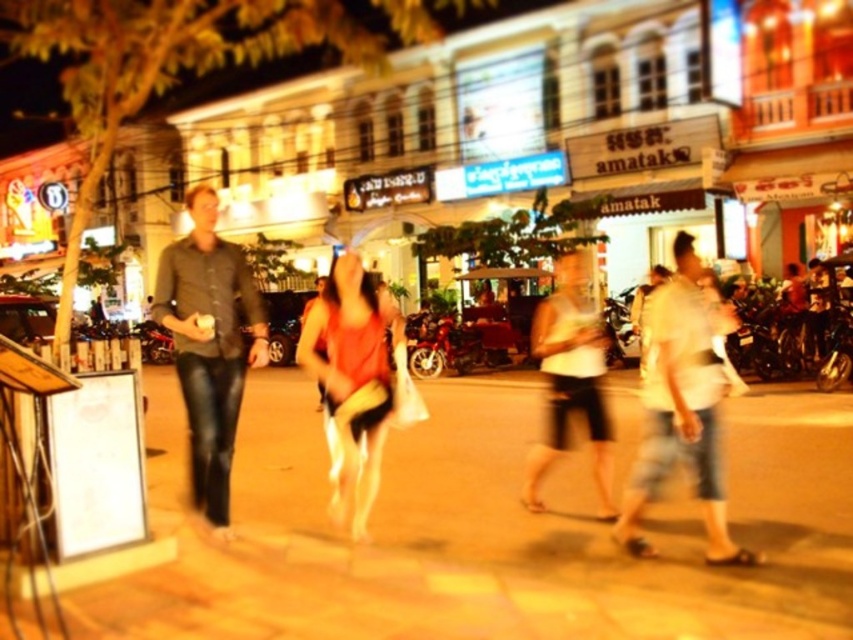
Does point (279, 378) come farther from viewer compared to point (705, 456)?

Yes.

Who is positioned more to the left, brown stone pavement at center or white cotton shirt at center?

brown stone pavement at center

Is point (173, 480) farther from camera compared to point (695, 445)?

Yes, it is.

Identify the location of brown stone pavement at center. The image size is (853, 640). (486, 531).

Does brown stone pavement at center appear on the right side of white matte shorts at center?

No, brown stone pavement at center is not to the right of white matte shorts at center.

Is brown stone pavement at center smaller than white matte shorts at center?

Yes.

Between point (622, 560) and point (543, 472), which one is positioned behind?

Positioned behind is point (543, 472).

Locate an element on the screen. This screenshot has height=640, width=853. brown stone pavement at center is located at coordinates (486, 531).

Can you confirm if brown stone pavement at center is positioned above matte orange tank top at center?

No, brown stone pavement at center is not above matte orange tank top at center.

Find the location of a particular element. brown stone pavement at center is located at coordinates (486, 531).